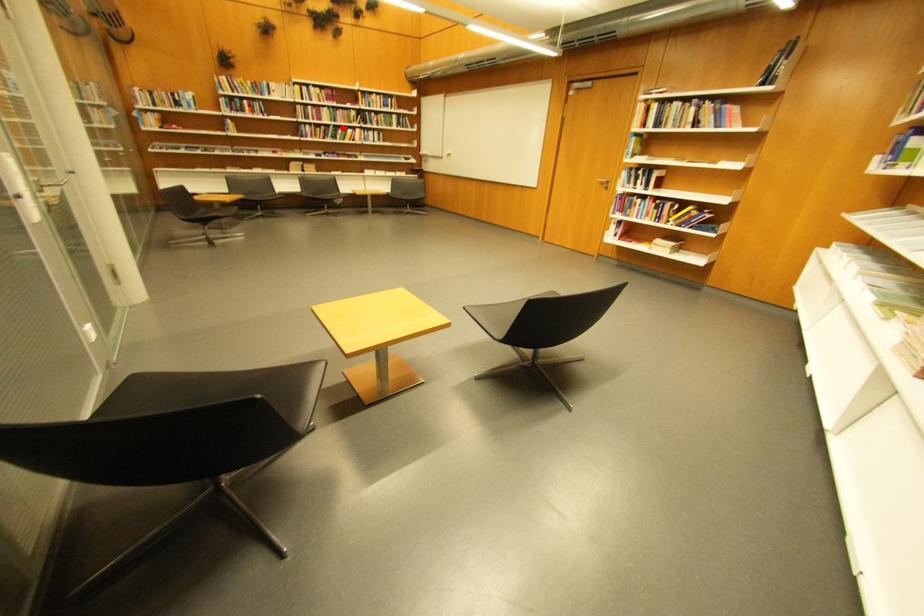
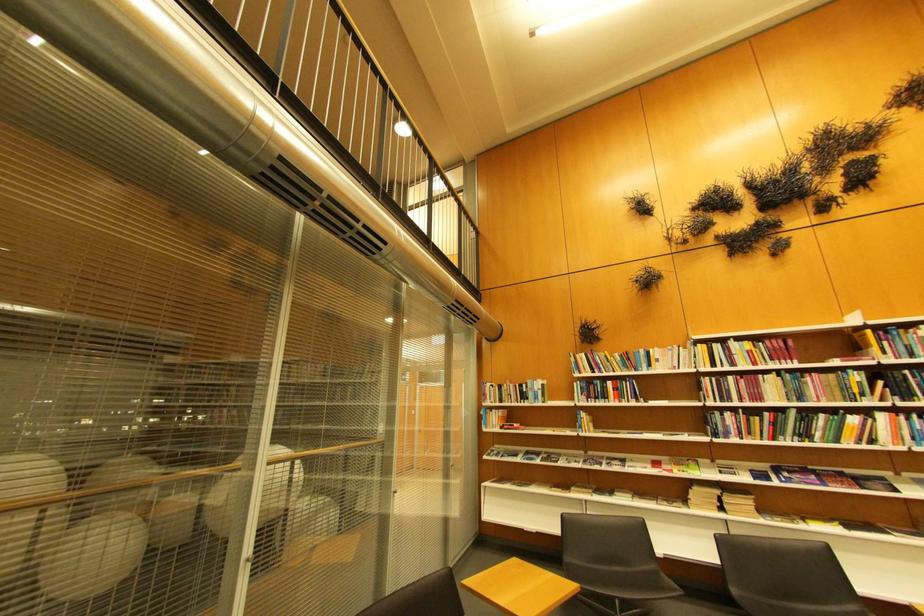
Find the pixel in the second image that matches the highlighted location in the first image.

(804, 413)